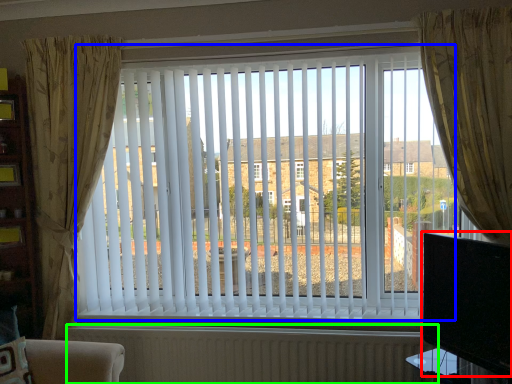
Question: Based on their relative distances, which object is farther from window screen (highlighted by a red box)? Choose from window blind (highlighted by a blue box) and radiator (highlighted by a green box).

Choices:
 (A) window blind
 (B) radiator

Answer: (A)